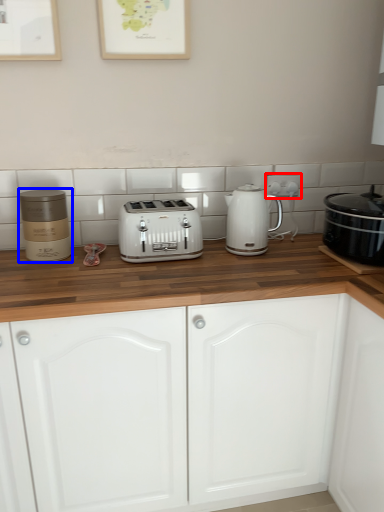
Question: Which point is further to the camera, electric outlet (highlighted by a red box) or appliance (highlighted by a blue box)?

Choices:
 (A) electric outlet
 (B) appliance

Answer: (A)